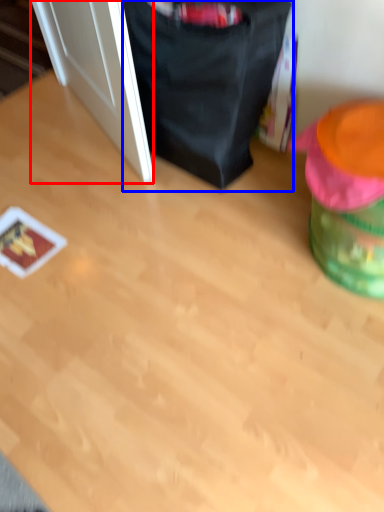
Question: Which of the following is the farthest to the observer, door (highlighted by a red box) or bean bag chair (highlighted by a blue box)?

Choices:
 (A) door
 (B) bean bag chair

Answer: (A)